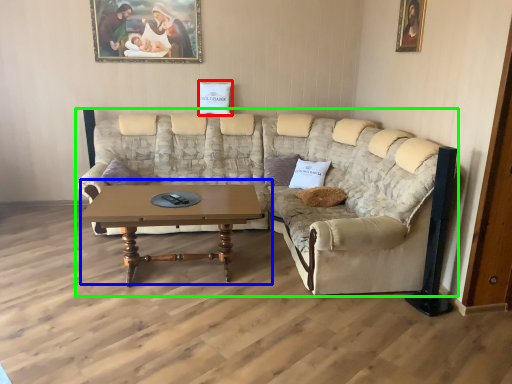
Question: Which object is positioned farthest from pillow (highlighted by a red box)? Select from coffee table (highlighted by a blue box) and studio couch (highlighted by a green box).

Choices:
 (A) coffee table
 (B) studio couch

Answer: (A)